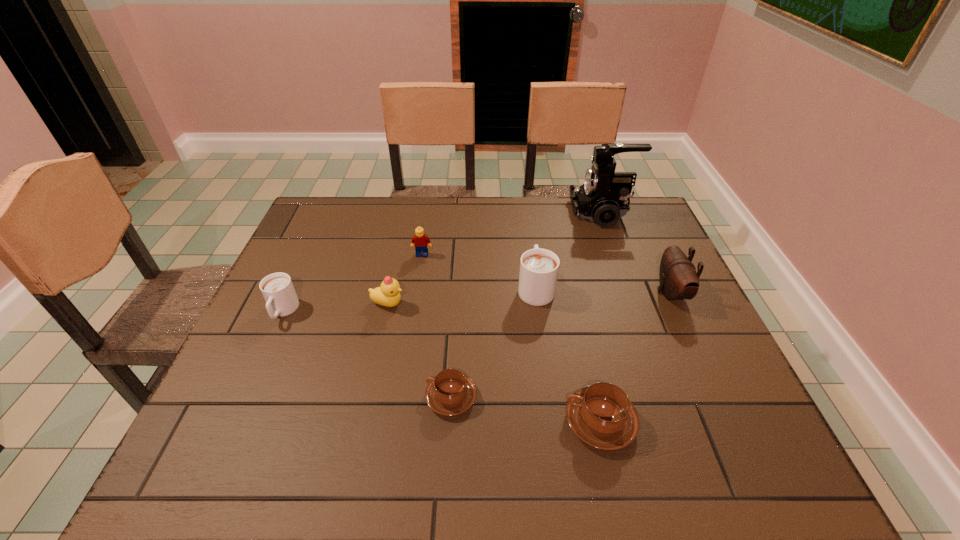
The height and width of the screenshot is (540, 960). In the image, there is a desktop. Identify the location of vacant space at the left edge. (299, 264).

Locate an element on the screen. blank space at the right edge of the desktop is located at coordinates (662, 364).

At what (x,y) coordinates should I click in order to perform the action: click on vacant space at the far left corner of the desktop. Please return your answer as a coordinate pair (x, y). Image resolution: width=960 pixels, height=540 pixels. Looking at the image, I should click on (304, 222).

The image size is (960, 540). Find the location of `vacant space in between the smaller brown cappuccino and the Lego`. vacant space in between the smaller brown cappuccino and the Lego is located at coordinates click(x=437, y=326).

Identify the location of vacant space that's between the tallest cappuccino and the leftmost cappuccino. The image size is (960, 540). (409, 300).

Locate an element on the screen. unoccupied area between the duckling and the shortest object is located at coordinates (420, 350).

Where is `free spot between the third tallest cappuccino and the duckling`? The width and height of the screenshot is (960, 540). free spot between the third tallest cappuccino and the duckling is located at coordinates (494, 363).

At what (x,y) coordinates should I click in order to perform the action: click on free space between the pouch and the leftmost cappuccino. Please return your answer as a coordinate pair (x, y). Looking at the image, I should click on (477, 302).

Find the location of a particular element. free spot between the brown pouch and the leftmost object is located at coordinates (477, 302).

This screenshot has height=540, width=960. Identify the location of free space between the tallest cappuccino and the yellow duckling. (462, 296).